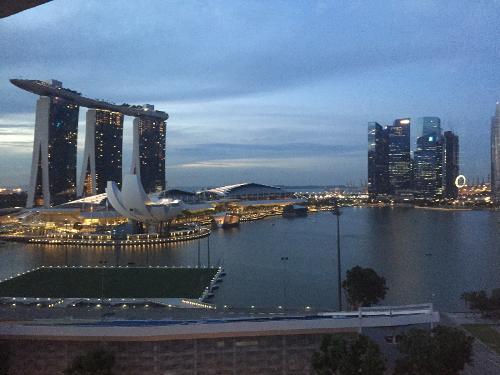
Identify the location of pillars. The width and height of the screenshot is (500, 375). (39, 139), (86, 142), (128, 141), (133, 184), (122, 200).